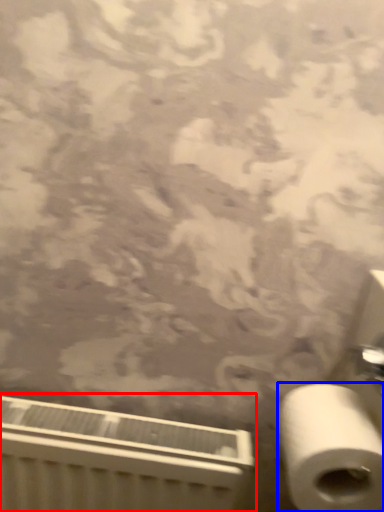
Question: Which point is closer to the camera, radiator (highlighted by a red box) or toilet paper (highlighted by a blue box)?

Choices:
 (A) radiator
 (B) toilet paper

Answer: (B)